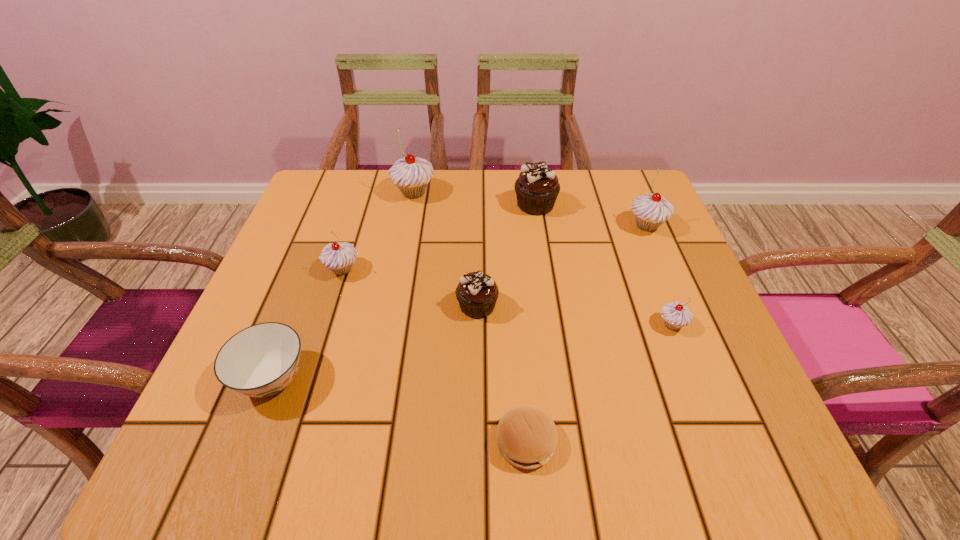
You are a GUI agent. You are given a task and a screenshot of the screen. Output one action in this format:
    pyautogui.click(x=<x>, y=<y>)
    Task: Click on the tallest object
    
    Given the screenshot: What is the action you would take?
    pyautogui.click(x=411, y=175)

Identify the location of the biggest gray cupcake. Image resolution: width=960 pixels, height=540 pixels. (411, 175).

Image resolution: width=960 pixels, height=540 pixels. In order to click on the third smallest gray cupcake in this screenshot , I will do `click(651, 210)`.

Identify the location of the second farthest gray cupcake. (651, 210).

At what (x,y) coordinates should I click in order to perform the action: click on the third cupcake from right to left. Please return your answer as a coordinate pair (x, y). Looking at the image, I should click on (537, 187).

Where is `the farther brown cupcake`? The height and width of the screenshot is (540, 960). the farther brown cupcake is located at coordinates (537, 187).

The image size is (960, 540). Find the location of `the leftmost gray cupcake`. the leftmost gray cupcake is located at coordinates (339, 257).

This screenshot has width=960, height=540. I want to click on the fourth farthest object, so click(x=339, y=257).

You are a GUI agent. You are given a task and a screenshot of the screen. Output one action in this format:
    pyautogui.click(x=<x>, y=<y>)
    Task: Click on the nearest gray cupcake
    The height and width of the screenshot is (540, 960).
    Given the screenshot: What is the action you would take?
    pyautogui.click(x=675, y=314)

Where is `the fourth cupcake from right to left`? This screenshot has height=540, width=960. the fourth cupcake from right to left is located at coordinates (477, 293).